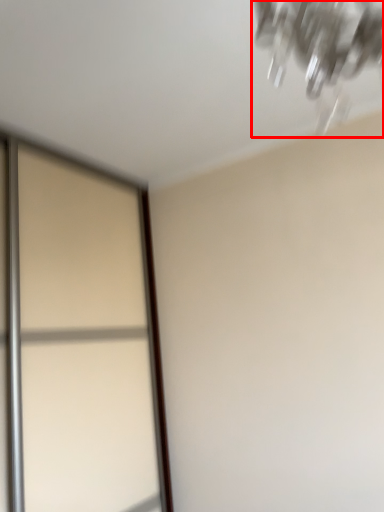
Question: From the image's perspective, where is lamp (annotated by the red box) located relative to screen door?

Choices:
 (A) above
 (B) below

Answer: (A)